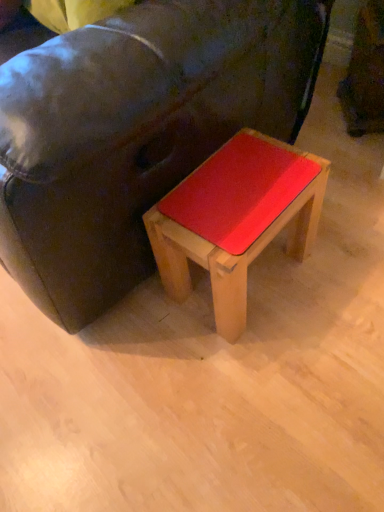
Question: Is matte black couch at center at the right side of matte wood stool at center?

Choices:
 (A) no
 (B) yes

Answer: (A)

Question: Considering the relative positions of matte black couch at center and matte wood stool at center in the image provided, is matte black couch at center in front of matte wood stool at center?

Choices:
 (A) yes
 (B) no

Answer: (A)

Question: Are matte black couch at center and matte wood stool at center far apart?

Choices:
 (A) no
 (B) yes

Answer: (A)

Question: Is matte wood stool at center a part of matte black couch at center?

Choices:
 (A) yes
 (B) no

Answer: (A)

Question: Is matte black couch at center taller than matte wood stool at center?

Choices:
 (A) yes
 (B) no

Answer: (A)

Question: From a real-world perspective, is matte black couch at center beneath matte wood stool at center?

Choices:
 (A) yes
 (B) no

Answer: (B)

Question: Is matte wood stool at center taller than matte black couch at center?

Choices:
 (A) yes
 (B) no

Answer: (B)

Question: From a real-world perspective, is matte wood stool at center over matte black couch at center?

Choices:
 (A) no
 (B) yes

Answer: (A)

Question: Does matte wood stool at center have a lesser width compared to matte black couch at center?

Choices:
 (A) no
 (B) yes

Answer: (B)

Question: Does matte wood stool at center have a larger size compared to matte black couch at center?

Choices:
 (A) no
 (B) yes

Answer: (A)

Question: Does matte wood stool at center turn towards matte black couch at center?

Choices:
 (A) yes
 (B) no

Answer: (B)

Question: Is matte wood stool at center positioned in front of matte black couch at center?

Choices:
 (A) yes
 (B) no

Answer: (B)

Question: From a real-world perspective, is matte wood stool at center physically located above or below matte black couch at center?

Choices:
 (A) below
 (B) above

Answer: (A)